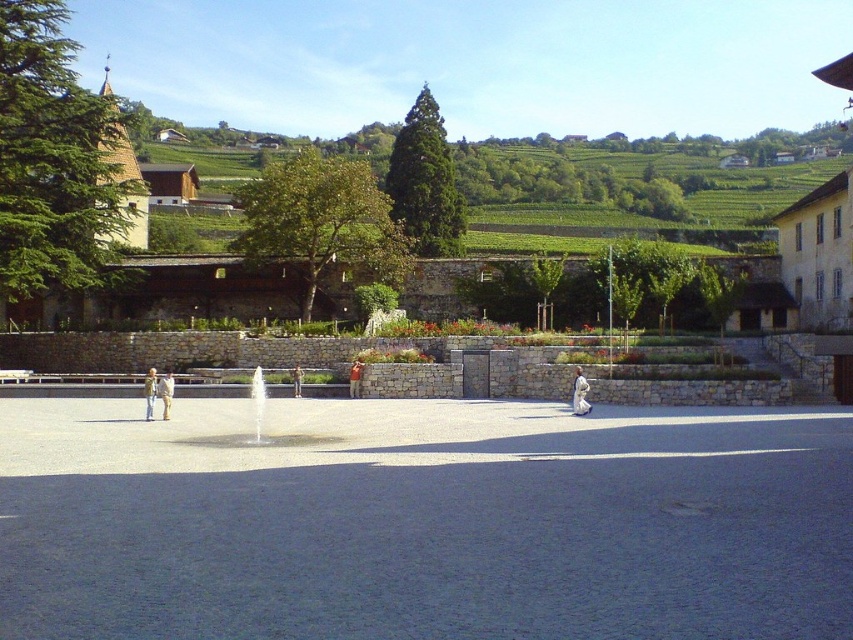
Can you confirm if white cotton jacket at lower right is taller than light brown leather jacket at left?

Correct, white cotton jacket at lower right is much taller as light brown leather jacket at left.

Measure the distance from white cotton jacket at lower right to light brown leather jacket at left.

white cotton jacket at lower right and light brown leather jacket at left are 43.46 feet apart from each other.

Is point (579, 384) positioned behind point (149, 406)?

Yes, it is behind point (149, 406).

Find the location of a particular element. Image resolution: width=853 pixels, height=640 pixels. white cotton jacket at lower right is located at coordinates coord(579,394).

Is light beige fabric jacket at left bigger than light brown leather jacket at center?

Yes.

Is light beige fabric jacket at left below light brown leather jacket at center?

No, light beige fabric jacket at left is not below light brown leather jacket at center.

You are a GUI agent. You are given a task and a screenshot of the screen. Output one action in this format:
    pyautogui.click(x=<x>, y=<y>)
    Task: Click on the light beige fabric jacket at left
    This screenshot has width=853, height=640.
    Given the screenshot: What is the action you would take?
    pyautogui.click(x=166, y=394)

Which is in front, point (259, 420) or point (149, 401)?

Point (259, 420) is more forward.

Between white marble fountain at center and light brown leather jacket at left, which one appears on the right side from the viewer's perspective?

From the viewer's perspective, white marble fountain at center appears more on the right side.

This screenshot has height=640, width=853. I want to click on white marble fountain at center, so click(257, 401).